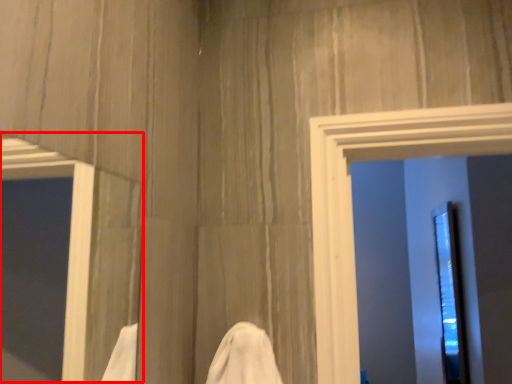
Question: From the image's perspective, what is the correct spatial positioning of window (annotated by the red box) in reference to screen door?

Choices:
 (A) above
 (B) below

Answer: (A)